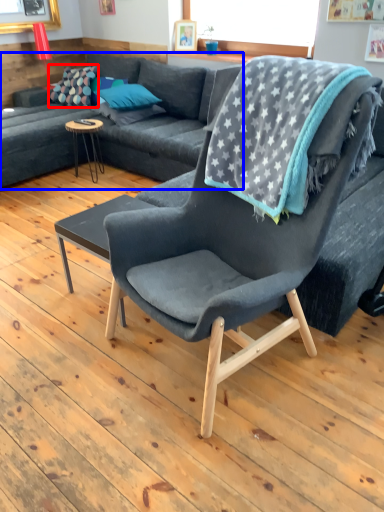
Question: Which object is further to the camera taking this photo, pillow (highlighted by a red box) or studio couch (highlighted by a blue box)?

Choices:
 (A) pillow
 (B) studio couch

Answer: (A)